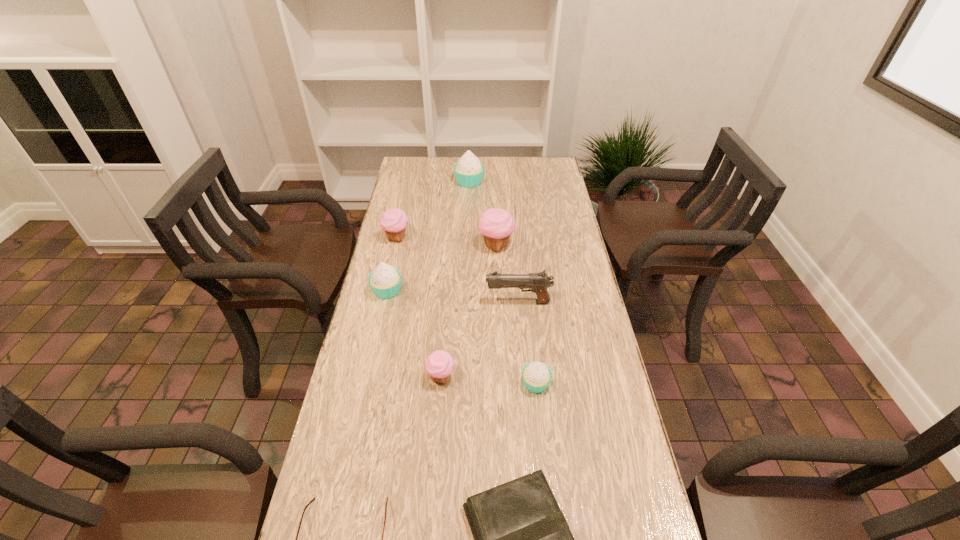
This screenshot has width=960, height=540. Identify the location of the second pink cupcake from left to right. (440, 364).

The width and height of the screenshot is (960, 540). I want to click on blank space located on the back of the biggest pink cupcake, so click(x=493, y=185).

At what (x,y) coordinates should I click in order to perform the action: click on vacant space positioned on the right of the farthest cupcake. Please return your answer as a coordinate pair (x, y). Looking at the image, I should click on (548, 182).

At what (x,y) coordinates should I click in order to perform the action: click on blank space located in the direction the gray gun is aimed. Please return your answer as a coordinate pair (x, y). Image resolution: width=960 pixels, height=540 pixels. Looking at the image, I should click on (454, 302).

Locate an element on the screen. The height and width of the screenshot is (540, 960). blank space located in the direction the gray gun is aimed is located at coordinates (442, 302).

Locate an element on the screen. blank area located in the direction the gray gun is aimed is located at coordinates click(x=389, y=302).

Locate an element on the screen. The image size is (960, 540). vacant position located on the right of the fourth farthest cupcake is located at coordinates click(470, 290).

I want to click on blank space located on the back of the leftmost pink cupcake, so click(408, 188).

What are the coordinates of `vacant space situated on the back of the rightmost white cupcake` in the screenshot? It's located at (528, 312).

Identify the location of free spot located on the front of the smallest pink cupcake. (437, 431).